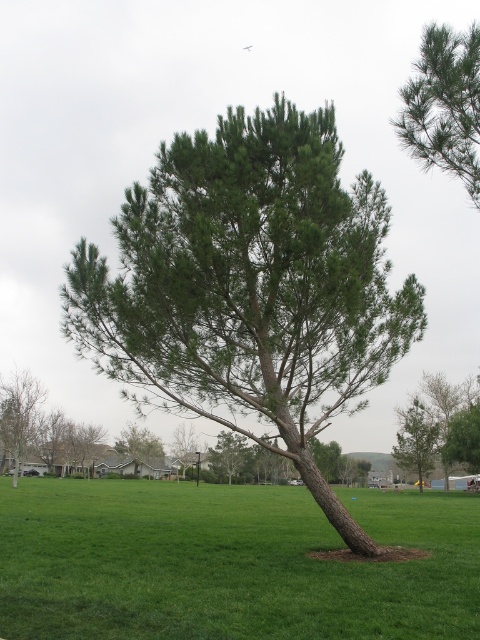
Question: Which is nearer to the green needle-like at center?

Choices:
 (A) brown leafy tree at lower left
 (B) green matte tree at lower right

Answer: (A)

Question: Which is nearer to the brown leafy tree at lower left?

Choices:
 (A) green matte tree at lower right
 (B) green grassy field at center
 (C) green needle-like at center
 (D) green needle-like leaves at upper right

Answer: (B)

Question: Among these objects, which one is farthest from the camera?

Choices:
 (A) brown leafy tree at lower left
 (B) green needle-like at center
 (C) green needle-like leaves at upper right

Answer: (A)

Question: Is green needle-like at center to the left of green leafy tree at lower right from the viewer's perspective?

Choices:
 (A) no
 (B) yes

Answer: (B)

Question: Does green leafy tree at lower right lie in front of brown leafy tree at lower left?

Choices:
 (A) no
 (B) yes

Answer: (A)

Question: Can you confirm if green leafy tree at lower right is thinner than brown leafy tree at lower left?

Choices:
 (A) yes
 (B) no

Answer: (B)